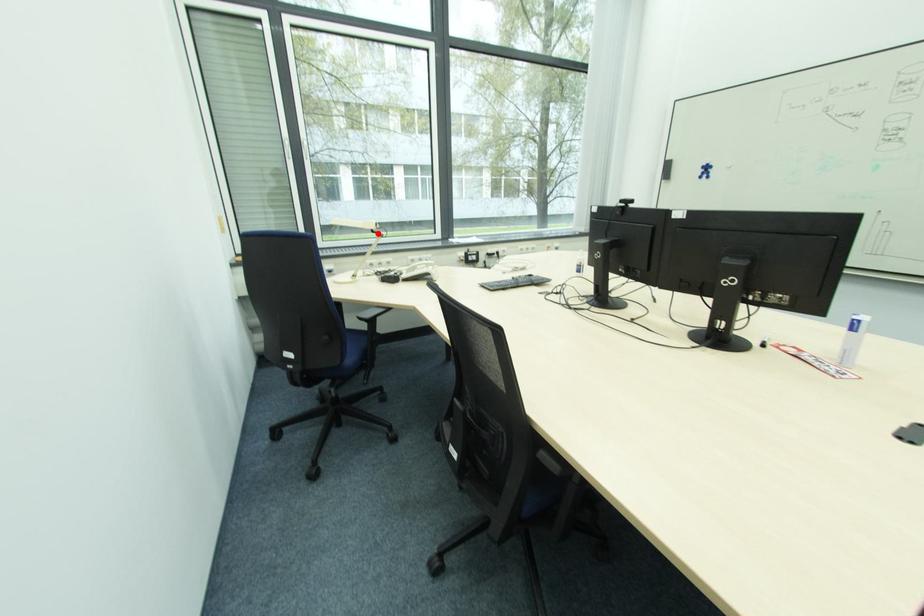
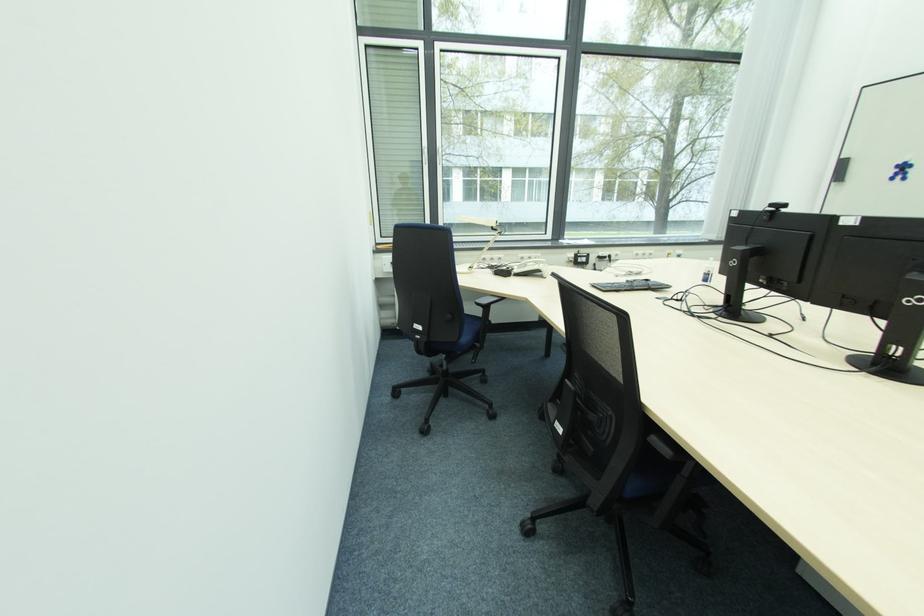
Question: A red point is marked in image1. In image2, is the corresponding 3D point closer to the camera or farther? Reply with the corresponding letter.

Choices:
 (A) The corresponding 3D point is closer.
 (B) The corresponding 3D point is farther.

Answer: (B)